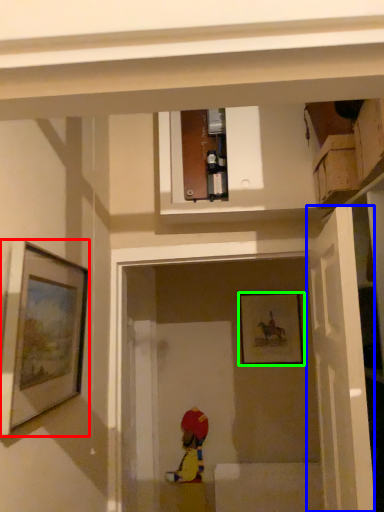
Question: Considering the real-world distances, which object is closest to picture frame (highlighted by a red box)? door (highlighted by a blue box) or picture frame (highlighted by a green box).

Choices:
 (A) door
 (B) picture frame

Answer: (A)